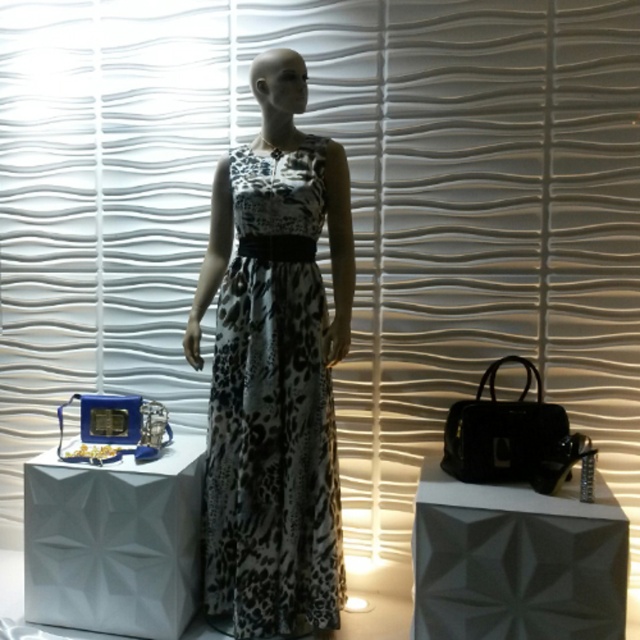
Question: Is black printed fabric dress at center further to camera compared to white matte box at lower left?

Choices:
 (A) yes
 (B) no

Answer: (B)

Question: Can you confirm if black printed fabric dress at center is smaller than white matte box at lower left?

Choices:
 (A) no
 (B) yes

Answer: (A)

Question: Is black printed fabric dress at center thinner than white matte box at lower left?

Choices:
 (A) no
 (B) yes

Answer: (B)